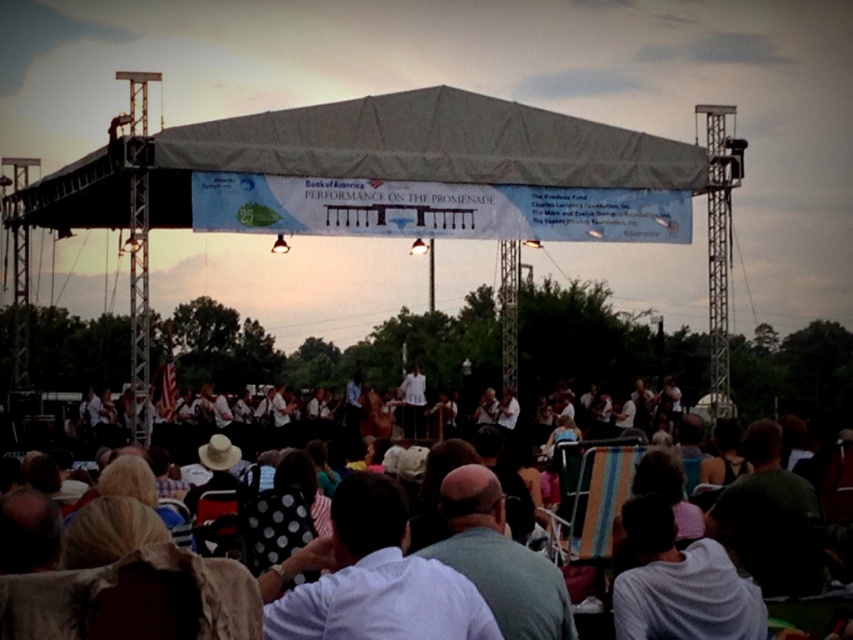
You are a photographer positioned at the center of the stage. You want to take a photo that includes both the gray fabric hat at center and the dark green shirt at lower right. Given that your camera has a maximum focus range of 80 feet, will you be able to capture both subjects in focus without moving your position?

The gray fabric hat at center is 79.15 feet away from the dark green shirt at lower right. Since the camera can focus up to 80 feet, the distance between them is within the camera range. Therefore, you can capture both subjects in focus without moving.

You are a photographer at the outdoor concert and need to capture a clear shot of both the white polka dot shirt at center and the gray fabric hat at center. Which object should you focus on first if you want to ensure both are in focus, considering their sizes?

The white polka dot shirt at center is bigger than the gray fabric hat at center, so you should focus on the white polka dot shirt at center first to ensure both are in focus.